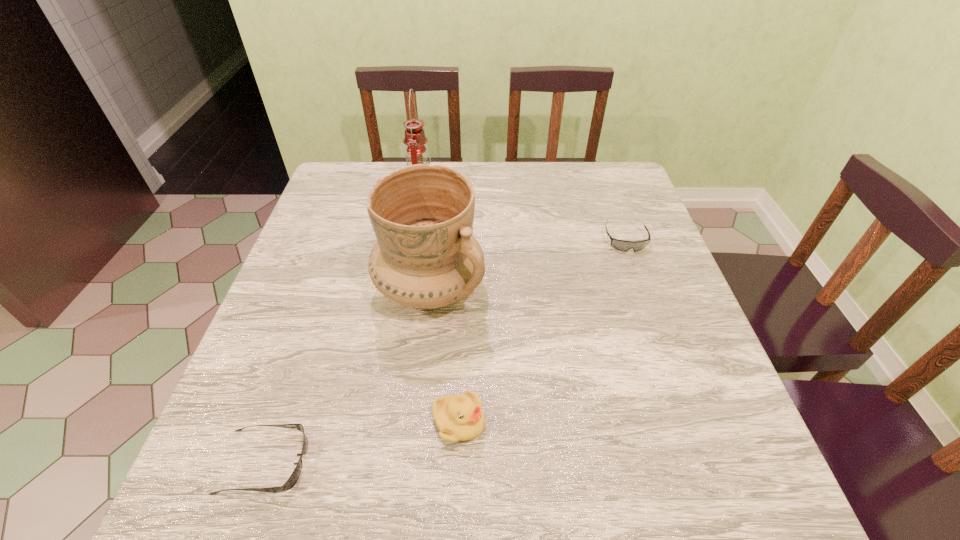
This screenshot has width=960, height=540. Identify the location of vacant space located 0.150m on the front-facing side of the leftmost object. (397, 462).

The image size is (960, 540). What are the coordinates of `object positioned at the far edge` in the screenshot? It's located at [415, 139].

Where is `object situated at the near edge`? object situated at the near edge is located at coordinates (292, 480).

This screenshot has width=960, height=540. What are the coordinates of `object that is at the left edge` in the screenshot? It's located at (292, 480).

Locate an element on the screen. This screenshot has width=960, height=540. object that is at the right edge is located at coordinates (622, 245).

Locate an element on the screen. The width and height of the screenshot is (960, 540). object at the near left corner is located at coordinates (292, 480).

This screenshot has height=540, width=960. I want to click on free spot at the far edge of the desktop, so click(576, 203).

Image resolution: width=960 pixels, height=540 pixels. In the image, there is a desktop. What are the coordinates of `vacant space at the left edge` in the screenshot? It's located at (345, 227).

Image resolution: width=960 pixels, height=540 pixels. I want to click on free space at the right edge of the desktop, so click(696, 352).

In the image, there is a desktop. Identify the location of vacant area at the far left corner. Image resolution: width=960 pixels, height=540 pixels. (362, 161).